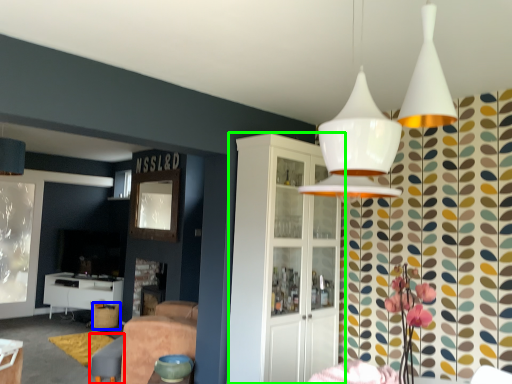
Question: Which is nearer to the swivel chair (highlighted by a red box)? bar stool (highlighted by a blue box) or cabinetry (highlighted by a green box).

Choices:
 (A) bar stool
 (B) cabinetry

Answer: (A)